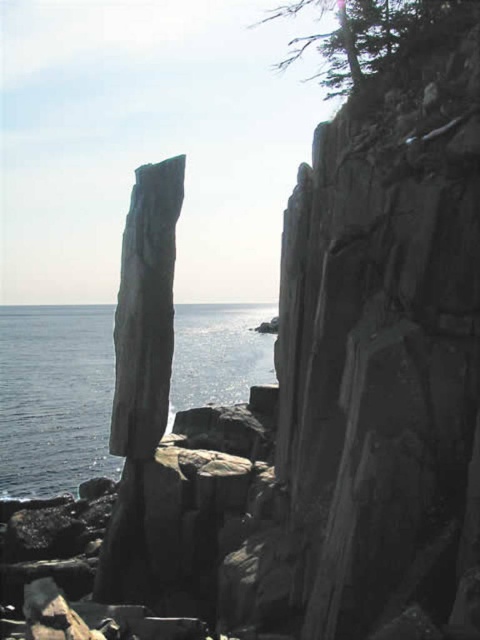
Can you confirm if blue water at center is smaller than green textured tree at upper center?

→ Yes, blue water at center is smaller than green textured tree at upper center.

Does blue water at center appear over green textured tree at upper center?

Incorrect, blue water at center is not positioned above green textured tree at upper center.

Which is in front, point (26, 460) or point (288, 60)?

Point (26, 460)

Locate an element on the screen. blue water at center is located at coordinates (55, 397).